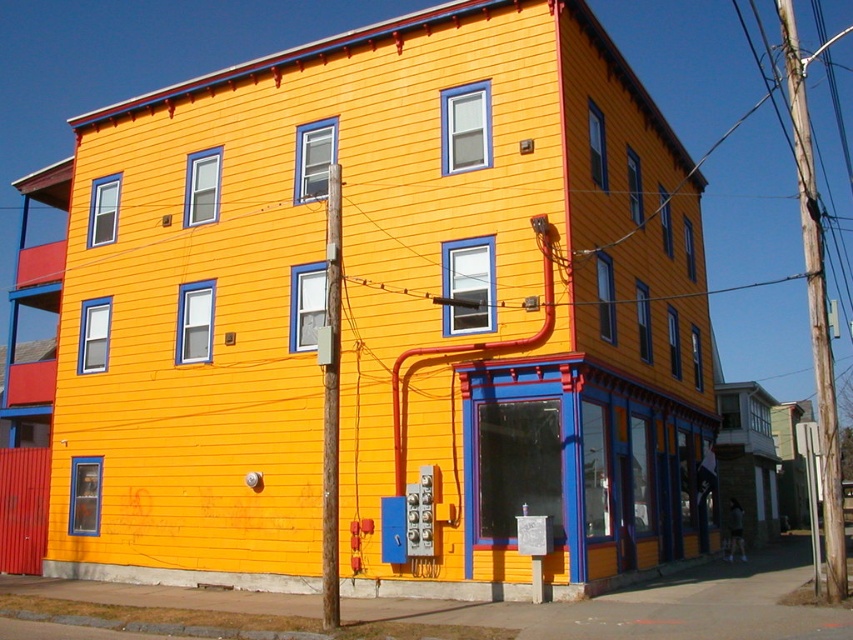
Can you confirm if wooden utility pole at right is positioned to the right of smooth wood pole at center?

Indeed, wooden utility pole at right is positioned on the right side of smooth wood pole at center.

Is wooden utility pole at right thinner than smooth wood pole at center?

In fact, wooden utility pole at right might be wider than smooth wood pole at center.

What do you see at coordinates (815, 308) in the screenshot? Image resolution: width=853 pixels, height=640 pixels. I see `wooden utility pole at right` at bounding box center [815, 308].

Locate an element on the screen. wooden utility pole at right is located at coordinates (815, 308).